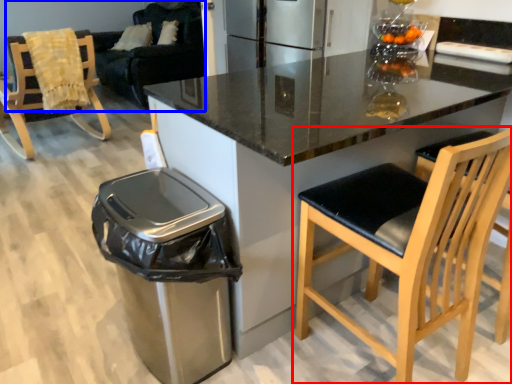
Question: Which object appears farthest to the camera in this image, chair (highlighted by a red box) or couch (highlighted by a blue box)?

Choices:
 (A) chair
 (B) couch

Answer: (B)